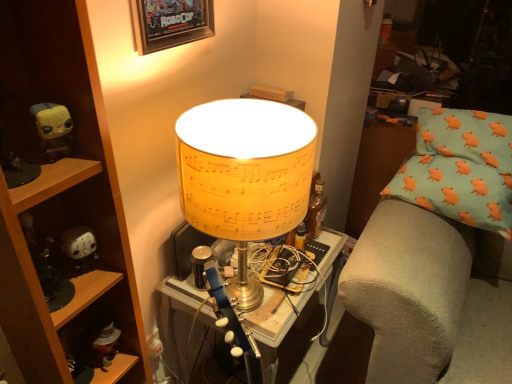
Question: From a real-world perspective, is wooden shelf at left on matte yellow lampshade at center?

Choices:
 (A) yes
 (B) no

Answer: (A)

Question: Is wooden shelf at left positioned with its back to matte yellow lampshade at center?

Choices:
 (A) no
 (B) yes

Answer: (B)

Question: Is the position of wooden shelf at left less distant than that of matte yellow lampshade at center?

Choices:
 (A) yes
 (B) no

Answer: (B)

Question: Is matte yellow lampshade at center completely or partially inside wooden shelf at left?

Choices:
 (A) yes
 (B) no

Answer: (B)

Question: From the image's perspective, is wooden shelf at left located above matte yellow lampshade at center?

Choices:
 (A) yes
 (B) no

Answer: (A)

Question: In terms of width, does wooden framed poster at upper center look wider or thinner when compared to yellow matte toy at left, positioned as the first toy in top-to-bottom order?

Choices:
 (A) wide
 (B) thin

Answer: (B)

Question: In terms of height, does wooden framed poster at upper center look taller or shorter compared to yellow matte toy at left, which is the 1th toy from front to back?

Choices:
 (A) tall
 (B) short

Answer: (A)

Question: From a real-world perspective, is wooden framed poster at upper center positioned above or below yellow matte toy at left, which is counted as the 2th toy, starting from the bottom?

Choices:
 (A) above
 (B) below

Answer: (A)

Question: Considering their positions, is wooden framed poster at upper center located in front of or behind yellow matte toy at left, which is counted as the 2th toy, starting from the bottom?

Choices:
 (A) front
 (B) behind

Answer: (B)

Question: Is black matte jason voorhees mask at left, the first toy when ordered from back to front, bigger or smaller than wooden framed poster at upper center?

Choices:
 (A) small
 (B) big

Answer: (A)

Question: From the image's perspective, is black matte jason voorhees mask at left, the 1th toy when ordered from bottom to top, positioned above or below wooden framed poster at upper center?

Choices:
 (A) above
 (B) below

Answer: (B)

Question: In the image, is black matte jason voorhees mask at left, the 2th toy viewed from the top, on the left side or the right side of wooden framed poster at upper center?

Choices:
 (A) right
 (B) left

Answer: (B)

Question: Is black matte jason voorhees mask at left, the 1th toy when ordered from bottom to top, inside or outside of wooden framed poster at upper center?

Choices:
 (A) inside
 (B) outside

Answer: (B)

Question: Is matte yellow lampshade at center taller or shorter than black matte jason voorhees mask at left, the second toy from the front?

Choices:
 (A) tall
 (B) short

Answer: (A)

Question: Is matte yellow lampshade at center inside the boundaries of black matte jason voorhees mask at left, the 1th toy when ordered from bottom to top, or outside?

Choices:
 (A) inside
 (B) outside

Answer: (B)